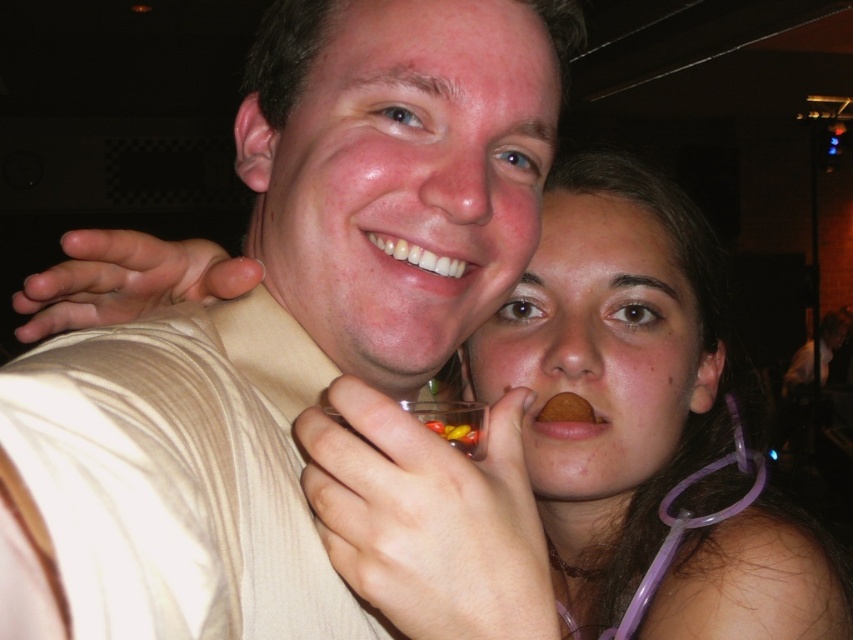
You are at a party and see two snacks at the mouths of two people. The snacks are the brown matte cookie at mouth and the translucent plastic candy at mouth. Which snack is taller?

The brown matte cookie at mouth is taller than the translucent plastic candy at mouth.

From the picture: You are at a party and want to grab the translucent plastic cup at center without touching the matte beige shirt at center. Is it possible based on their positions?

The matte beige shirt at center is positioned on the left side of the translucent plastic cup at center, so you can reach the cup from the right side without touching the shirt.